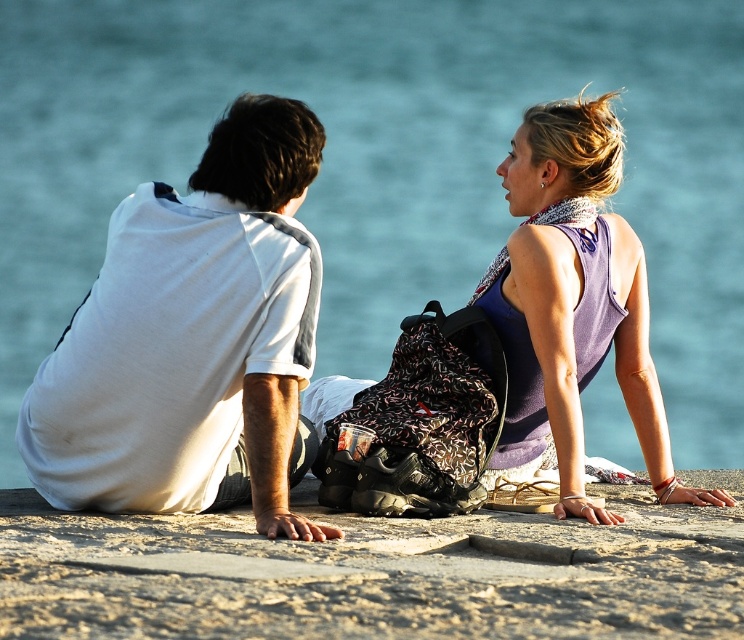
Question: Does white cotton shirt at left have a greater width compared to purple fabric tank top at upper right?

Choices:
 (A) yes
 (B) no

Answer: (A)

Question: Can you confirm if smooth concrete surface at center is smaller than purple fabric tank top at upper right?

Choices:
 (A) no
 (B) yes

Answer: (B)

Question: Which point is farther to the camera?

Choices:
 (A) smooth concrete surface at center
 (B) purple fabric tank top at upper right

Answer: (B)

Question: Is white cotton shirt at left bigger than purple fabric tank top at upper right?

Choices:
 (A) no
 (B) yes

Answer: (A)

Question: Which point is farther to the camera?

Choices:
 (A) white cotton shirt at left
 (B) purple fabric tank top at upper right
 (C) smooth concrete surface at center

Answer: (B)

Question: Which point is closer to the camera taking this photo?

Choices:
 (A) (530, 202)
 (B) (89, 467)

Answer: (B)